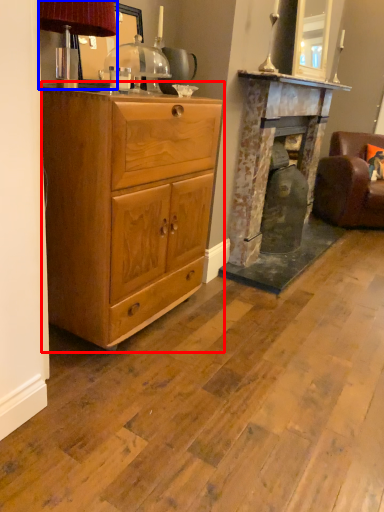
Question: Among these objects, which one is farthest to the camera, chest of drawers (highlighted by a red box) or table lamp (highlighted by a blue box)?

Choices:
 (A) chest of drawers
 (B) table lamp

Answer: (A)